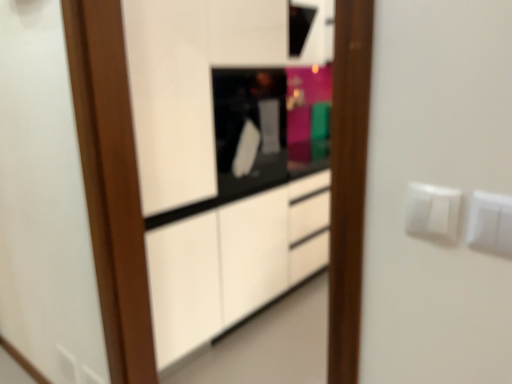
Question: Looking at the image, does white plastic switch at upper right, positioned as the second electric outlet in right-to-left order, seem bigger or smaller compared to white plastic electric outlet at right, which is the 1th electric outlet in right-to-left order?

Choices:
 (A) big
 (B) small

Answer: (A)

Question: Looking at their shapes, would you say white plastic switch at upper right, which is the first electric outlet in top-to-bottom order, is wider or thinner than white plastic electric outlet at right, which is counted as the 3th electric outlet, starting from the back?

Choices:
 (A) thin
 (B) wide

Answer: (A)

Question: Estimate the real-world distances between objects in this image. Which object is farther from the white plastic electric outlet at right, marked as the 3th electric outlet in a left-to-right arrangement?

Choices:
 (A) white plastic electric outlet at lower left, the 3th electric outlet from the right
 (B) black glossy microwave at center
 (C) white plastic switch at upper right, which is the first electric outlet in top-to-bottom order

Answer: (A)

Question: Based on their relative distances, which object is farther from the black glossy microwave at center?

Choices:
 (A) white plastic electric outlet at lower left, the first electric outlet in the back-to-front sequence
 (B) white plastic switch at upper right, which ranks as the 2th electric outlet in left-to-right order
 (C) white plastic electric outlet at right, which is counted as the 3th electric outlet, starting from the back

Answer: (C)